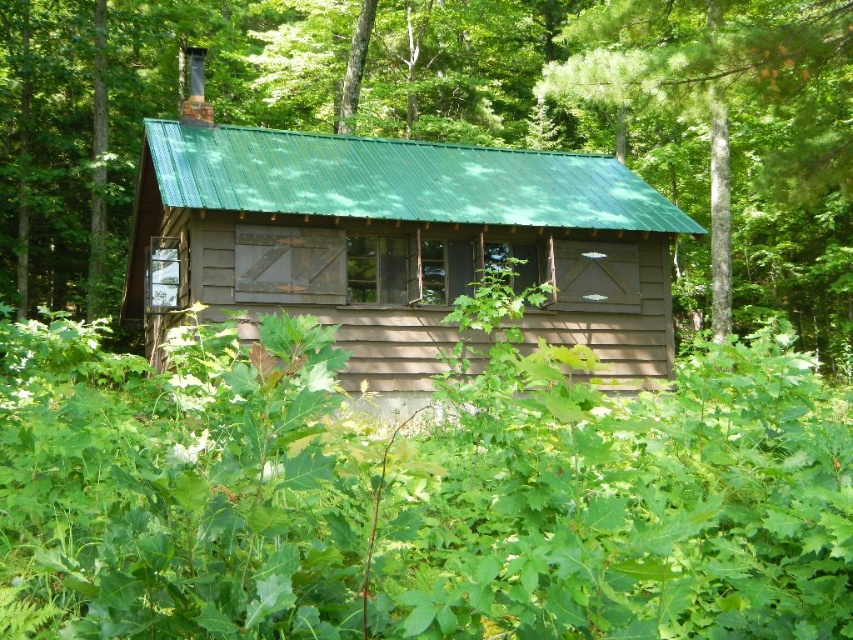
You are standing in front of the brown wooden cabin at center and looking towards the green leafy foliage at center. Which object is taller?

The green leafy foliage at center is taller than the brown wooden cabin at center.

You are standing at point (305, 301) and want to move to the cabin entrance. There is an obstacle at point (48, 288). Can you walk directly to the cabin entrance without going around the obstacle?

Point (48, 288) is behind point (305, 301), so you can walk directly to the cabin entrance without going around the obstacle.